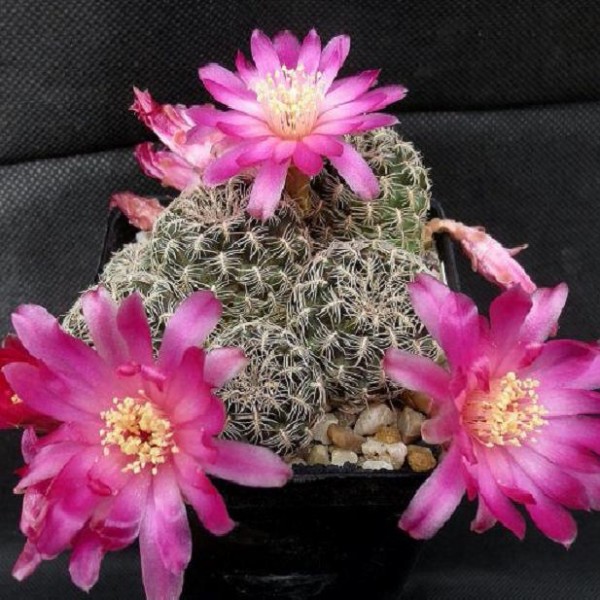
Find the location of a particular element. Image resolution: width=600 pixels, height=600 pixels. surface is located at coordinates (61, 187).